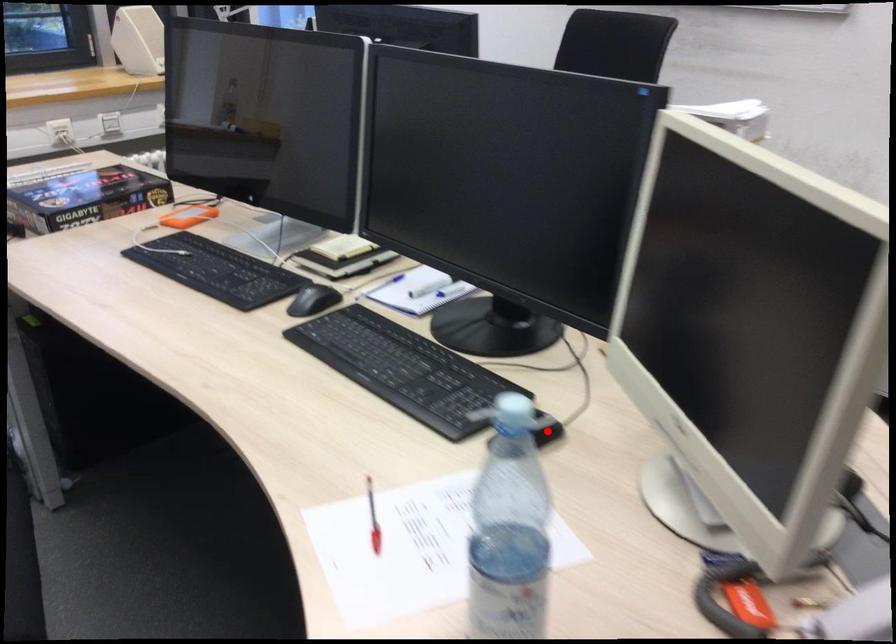
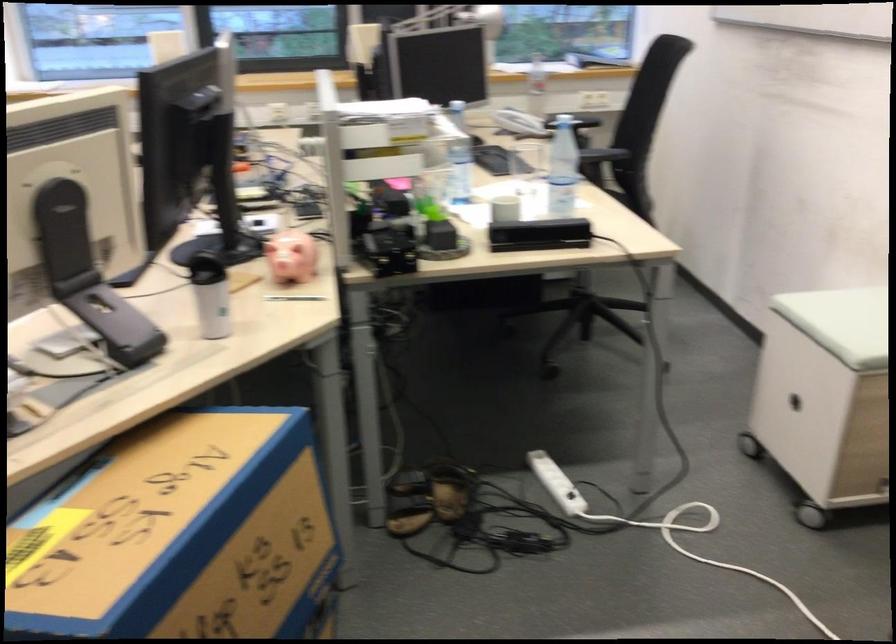
Question: I am providing you with two images of the same scene from different viewpoints. A red point is marked on the first image. At the location where the point appears in image 1, is it still visible in image 2?

Choices:
 (A) Yes
 (B) No

Answer: (B)